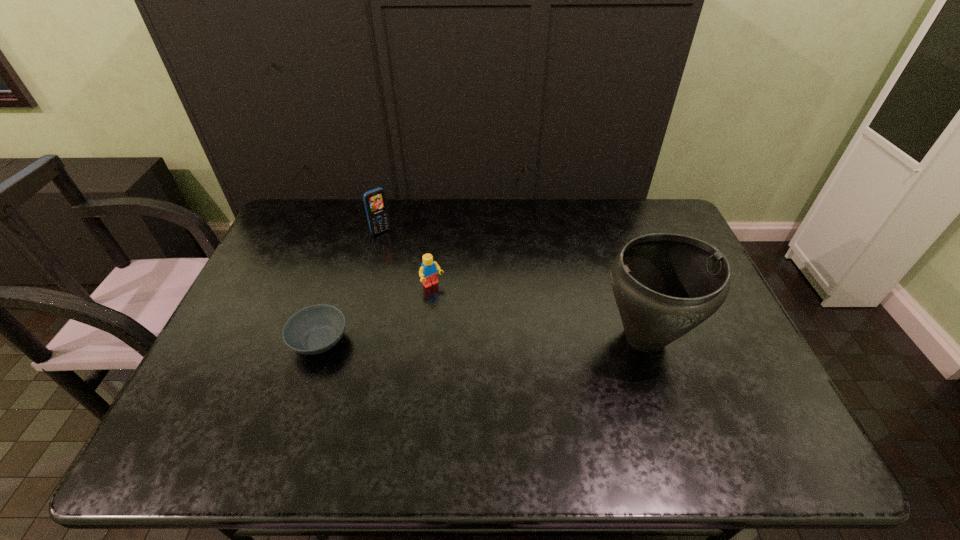
Where is `free space between the urn and the soup bowl`? The image size is (960, 540). free space between the urn and the soup bowl is located at coordinates (482, 339).

Locate which object is the third closest to the shortest object. Please provide its 2D coordinates. Your answer should be formatted as a tuple, i.e. [(x, y)], where the tuple contains the x and y coordinates of a point satisfying the conditions above.

[(665, 285)]

Locate an element on the screen. object that is the second nearest to the second tallest object is located at coordinates (315, 329).

I want to click on vacant point that satisfies the following two spatial constraints: 1. on the front side of the farthest object; 2. on the right side of the urn, so point(353,338).